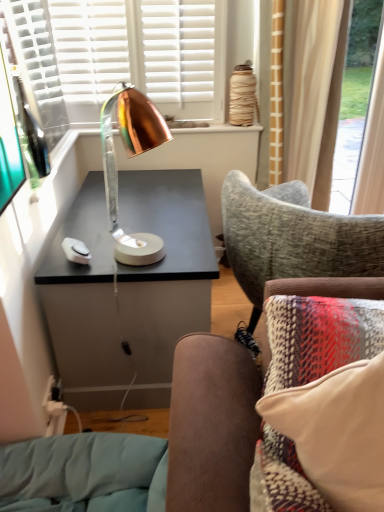
Question: Can you confirm if copper metallic lamp at center is wider than white soft pillow at lower right?

Choices:
 (A) yes
 (B) no

Answer: (B)

Question: Is copper metallic lamp at center next to white soft pillow at lower right?

Choices:
 (A) yes
 (B) no

Answer: (B)

Question: Would you say copper metallic lamp at center is a long distance from white soft pillow at lower right?

Choices:
 (A) no
 (B) yes

Answer: (A)

Question: From the image's perspective, is copper metallic lamp at center beneath white soft pillow at lower right?

Choices:
 (A) no
 (B) yes

Answer: (A)

Question: Considering the relative positions of copper metallic lamp at center and white soft pillow at lower right in the image provided, is copper metallic lamp at center to the right of white soft pillow at lower right from the viewer's perspective?

Choices:
 (A) no
 (B) yes

Answer: (A)

Question: Is copper metallic lamp at center further to camera compared to white soft pillow at lower right?

Choices:
 (A) yes
 (B) no

Answer: (A)

Question: Is white soft pillow at lower right in contact with copper metallic lamp at center?

Choices:
 (A) no
 (B) yes

Answer: (A)

Question: Can you confirm if white soft pillow at lower right is wider than copper metallic lamp at center?

Choices:
 (A) no
 (B) yes

Answer: (B)

Question: Does white soft pillow at lower right have a lesser height compared to copper metallic lamp at center?

Choices:
 (A) yes
 (B) no

Answer: (A)

Question: From a real-world perspective, is white soft pillow at lower right below copper metallic lamp at center?

Choices:
 (A) no
 (B) yes

Answer: (B)

Question: Is copper metallic lamp at center surrounded by white soft pillow at lower right?

Choices:
 (A) no
 (B) yes

Answer: (A)

Question: Does white soft pillow at lower right have a larger size compared to copper metallic lamp at center?

Choices:
 (A) yes
 (B) no

Answer: (A)

Question: Considering the positions of point (296, 421) and point (162, 243), is point (296, 421) closer or farther from the camera than point (162, 243)?

Choices:
 (A) farther
 (B) closer

Answer: (B)